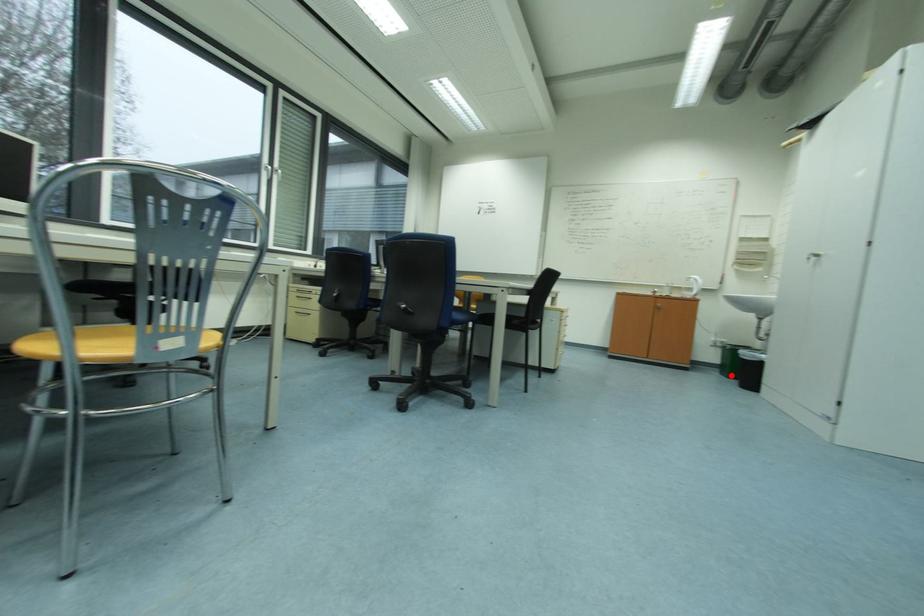
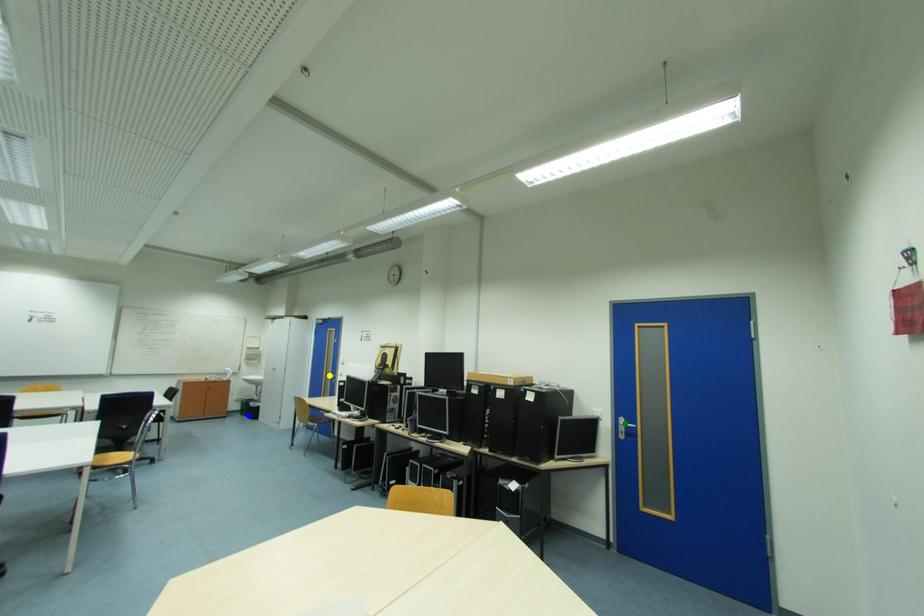
Question: I am providing you with two images of the same scene from different viewpoints. A red point is marked on the first image. You are given multiple points on the second image. Which mark in image 2 goes with the point in image 1?

Choices:
 (A) yellow point
 (B) blue point
 (C) green point

Answer: (B)